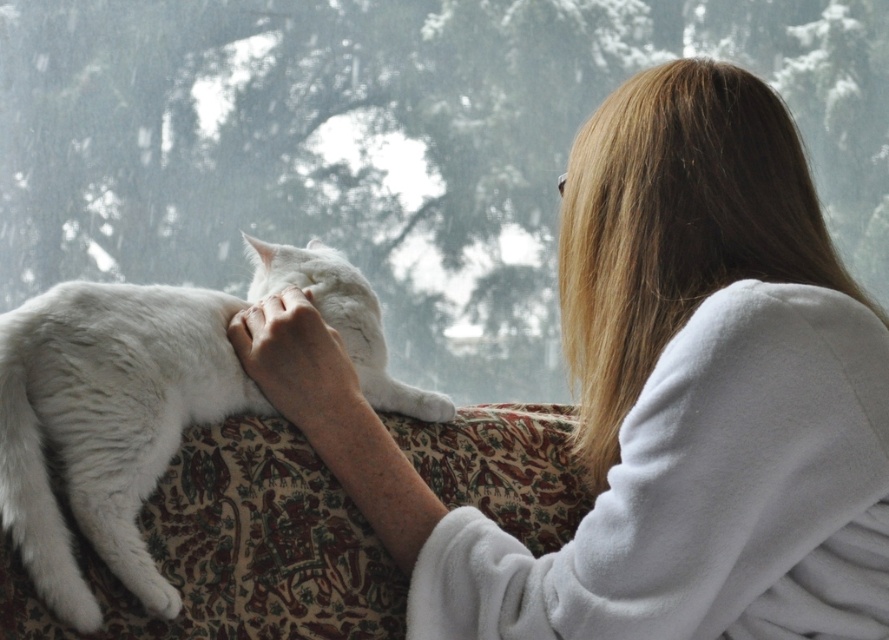
Is white fluffy robe at upper right to the right of white fluffy cat at center from the viewer's perspective?

Indeed, white fluffy robe at upper right is positioned on the right side of white fluffy cat at center.

Is white fluffy robe at upper right taller than white fluffy cat at center?

Correct, white fluffy robe at upper right is much taller as white fluffy cat at center.

Does point (647, 472) come closer to viewer compared to point (242, 236)?

Yes, point (647, 472) is in front of point (242, 236).

The image size is (889, 640). Identify the location of white fluffy robe at upper right. (655, 397).